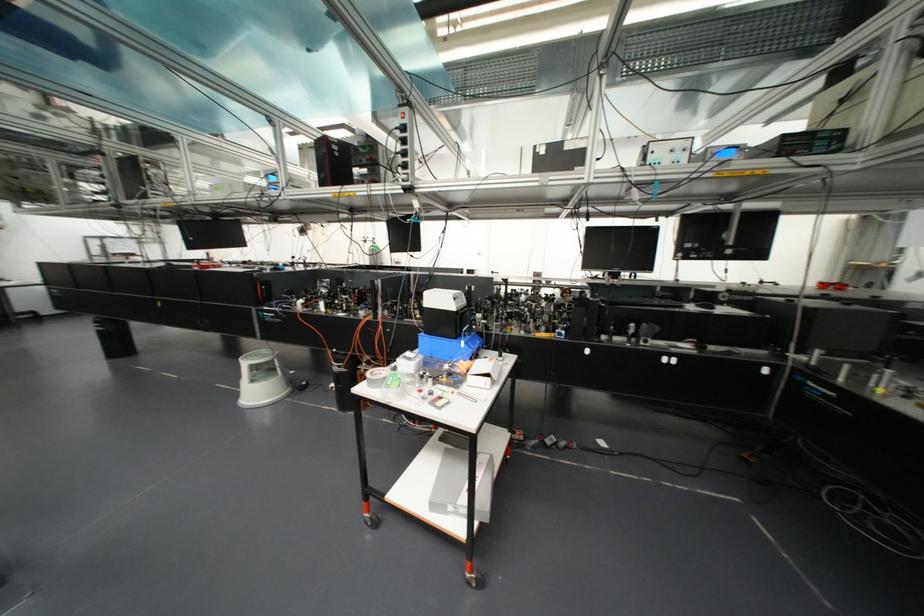
Where would you lift the black keyboard? Please return your answer as a coordinate pair (x, y).

(640, 302)